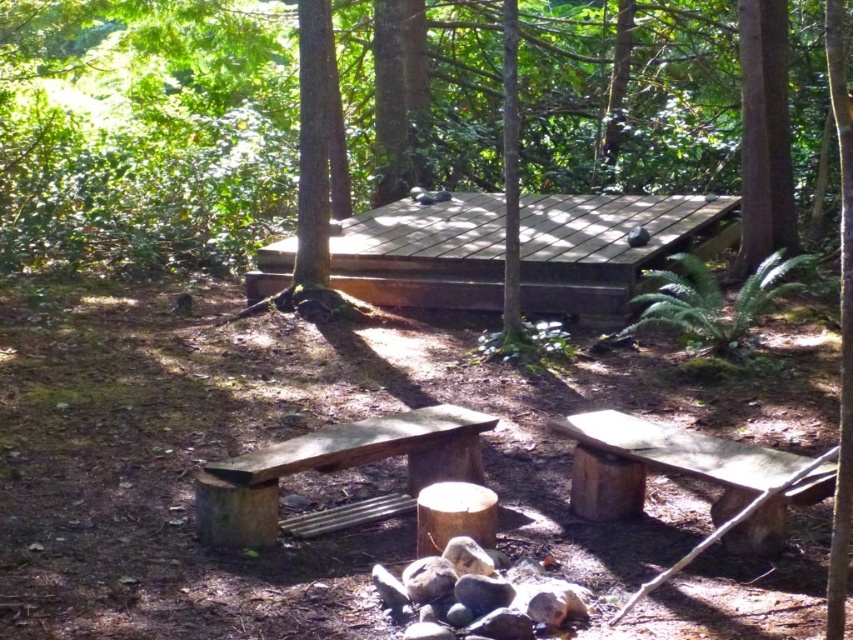
You are standing at the center of the platform and want to sit down. Which direction should you walk to reach the wooden bench at lower right?

You should walk towards the lower right direction to reach the wooden bench at lower right.

Consider the image. You are a hiker who wants to sit on the wooden bench at lower right and brown wood bench at center. Which bench is shorter?

The wooden bench at lower right is shorter than the brown wood bench at center.